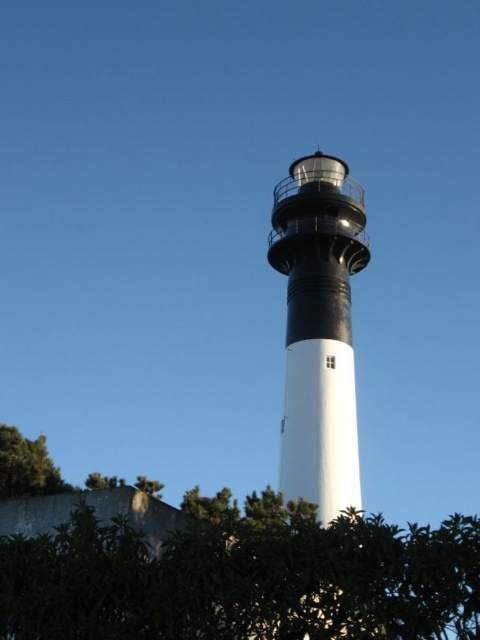
Question: Based on their relative distances, which object is farther from the white matte/light tower at center?

Choices:
 (A) green leafy tree at lower left
 (B) green leafy hedge at lower left

Answer: (B)

Question: Which object is closer to the camera taking this photo?

Choices:
 (A) white matte/light tower at center
 (B) green leafy hedge at lower left

Answer: (B)

Question: Can you confirm if green leafy hedge at lower left is positioned above green leafy tree at lower left?

Choices:
 (A) no
 (B) yes

Answer: (A)

Question: Can you confirm if green leafy hedge at lower left is positioned below green leafy tree at lower left?

Choices:
 (A) no
 (B) yes

Answer: (B)

Question: Is white matte/light tower at center closer to camera compared to green leafy tree at lower left?

Choices:
 (A) yes
 (B) no

Answer: (B)

Question: Which of the following is the farthest from the observer?

Choices:
 (A) (289, 385)
 (B) (96, 628)
 (C) (27, 484)

Answer: (A)